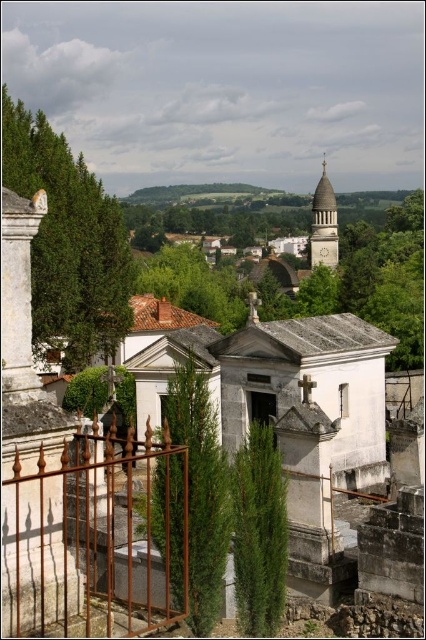
You are standing in the cemetery and want to touch both the rusty iron gate at lower left and the green textured stone at center. Which object should you reach for first to touch the one closer to you?

The rusty iron gate at lower left is closer to the viewer than the green textured stone at center, so you should reach for the rusty iron gate at lower left first.

You are a visitor standing in the cemetery and want to take a photo of the green textured stone wall at left and the green textured stone at center. Which object should you point your camera upwards to capture?

You should point your camera upwards to capture the green textured stone wall at left because it is located above the green textured stone at center.